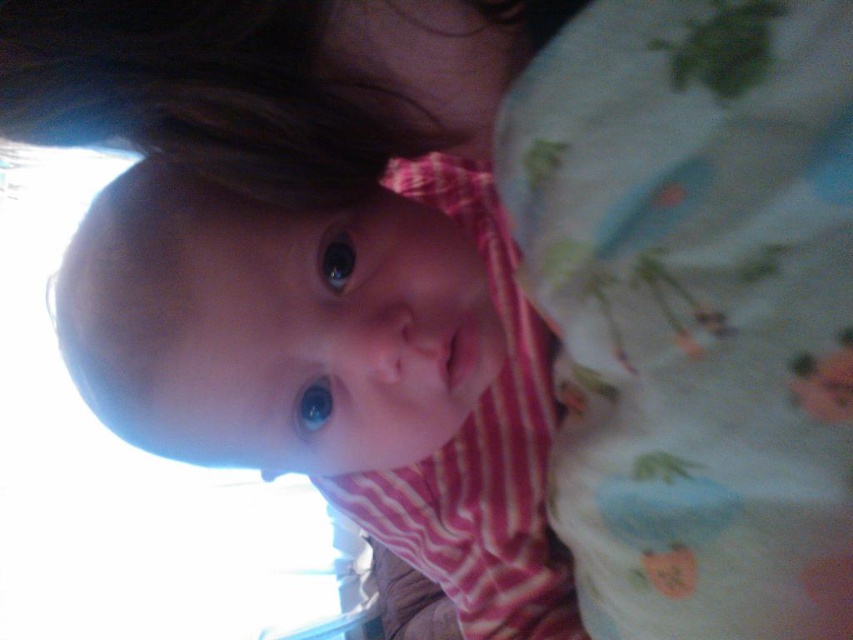
Question: Does light blue cotton blanket at upper right appear on the right side of pink striped shirt at center?

Choices:
 (A) no
 (B) yes

Answer: (B)

Question: Does light blue cotton blanket at upper right come behind pink striped shirt at center?

Choices:
 (A) yes
 (B) no

Answer: (B)

Question: Which point is closer to the camera taking this photo?

Choices:
 (A) (576, 369)
 (B) (65, 266)

Answer: (A)

Question: Which point is farther from the camera taking this photo?

Choices:
 (A) (512, 541)
 (B) (570, 337)

Answer: (A)

Question: Does light blue cotton blanket at upper right have a greater width compared to pink striped shirt at center?

Choices:
 (A) no
 (B) yes

Answer: (A)